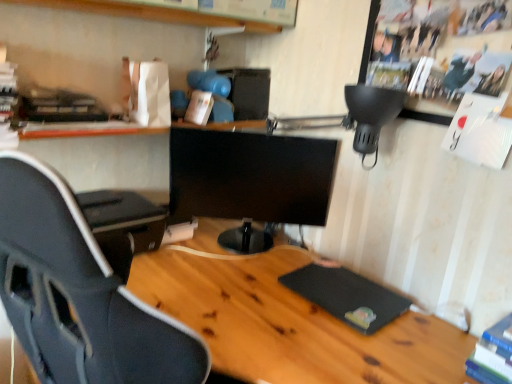
The image size is (512, 384). Identify the location of blank space situated above wooden desk at center (from a real-world perspective). (267, 301).